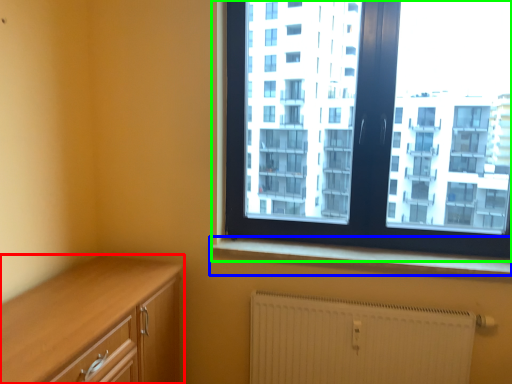
Question: Estimate the real-world distances between objects in this image. Which object is farther from cabinetry (highlighted by a red box), window sill (highlighted by a blue box) or window (highlighted by a green box)?

Choices:
 (A) window sill
 (B) window

Answer: (B)